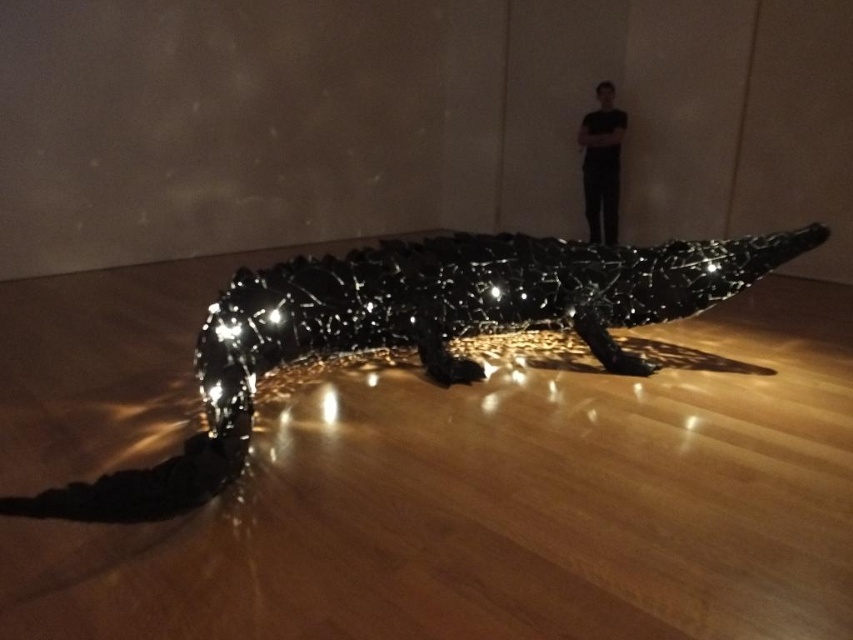
Question: Does glossy black crocodile at center have a larger size compared to black matte clothing at upper center?

Choices:
 (A) yes
 (B) no

Answer: (A)

Question: Which point appears farthest from the camera in this image?

Choices:
 (A) (595, 240)
 (B) (242, 461)

Answer: (A)

Question: Can you confirm if glossy black crocodile at center is thinner than black matte clothing at upper center?

Choices:
 (A) no
 (B) yes

Answer: (A)

Question: Is glossy black crocodile at center below black matte clothing at upper center?

Choices:
 (A) yes
 (B) no

Answer: (A)